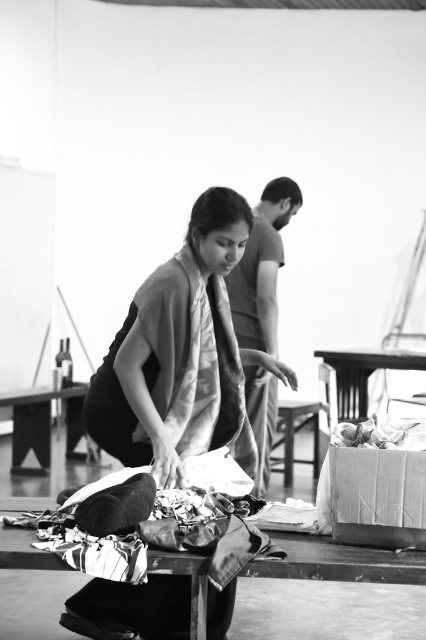
You are standing in a workshop and see the smooth gray shirt at upper center and the wooden table at center. Which object is nearer to you?

The smooth gray shirt at upper center is closer to the viewer than the wooden table at center.

You are organizing items in a cluttered room. You need to place a new item on top of the crinkled paper bag at lower right. However, there is a silky black dress at center in the way. Can you place the new item on the bag without moving the dress?

The crinkled paper bag at lower right is behind the silky black dress at center, so you cannot place the new item on the bag without moving the dress.